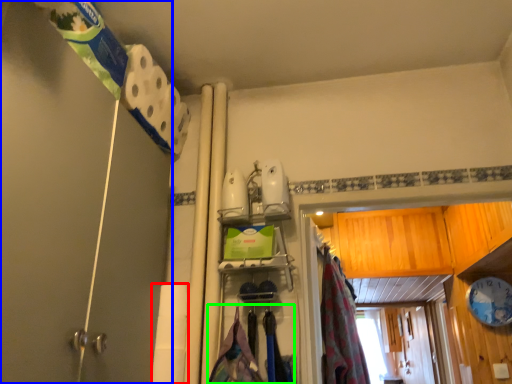
Question: Considering the real-world distances, which object is farthest from toilet paper (highlighted by a red box)? shower door (highlighted by a blue box) or laundry (highlighted by a green box)?

Choices:
 (A) shower door
 (B) laundry

Answer: (A)